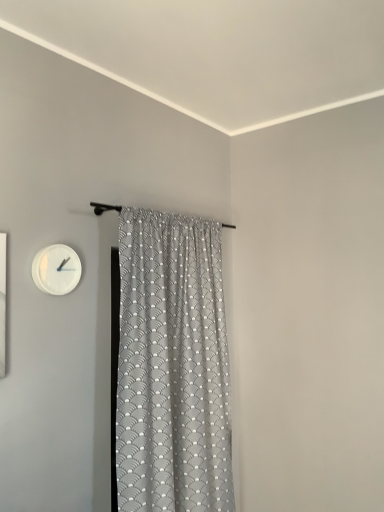
Question: Is gray textured fabric curtain at center far away from white matte wall clock at upper left?

Choices:
 (A) yes
 (B) no

Answer: (B)

Question: Is gray textured fabric curtain at center wider than white matte wall clock at upper left?

Choices:
 (A) no
 (B) yes

Answer: (B)

Question: Considering the relative sizes of gray textured fabric curtain at center and white matte wall clock at upper left in the image provided, is gray textured fabric curtain at center taller than white matte wall clock at upper left?

Choices:
 (A) yes
 (B) no

Answer: (A)

Question: Is gray textured fabric curtain at center in contact with white matte wall clock at upper left?

Choices:
 (A) no
 (B) yes

Answer: (A)

Question: Does gray textured fabric curtain at center appear on the left side of white matte wall clock at upper left?

Choices:
 (A) no
 (B) yes

Answer: (A)

Question: From a real-world perspective, is gray textured fabric curtain at center under white matte wall clock at upper left?

Choices:
 (A) no
 (B) yes

Answer: (B)

Question: Does white matte wall clock at upper left have a lesser height compared to gray textured fabric curtain at center?

Choices:
 (A) yes
 (B) no

Answer: (A)

Question: Could you tell me if white matte wall clock at upper left is turned towards gray textured fabric curtain at center?

Choices:
 (A) yes
 (B) no

Answer: (B)

Question: Is white matte wall clock at upper left far from gray textured fabric curtain at center?

Choices:
 (A) yes
 (B) no

Answer: (B)

Question: From a real-world perspective, is white matte wall clock at upper left on gray textured fabric curtain at center?

Choices:
 (A) no
 (B) yes

Answer: (B)

Question: Is white matte wall clock at upper left to the right of gray textured fabric curtain at center from the viewer's perspective?

Choices:
 (A) no
 (B) yes

Answer: (A)

Question: Does white matte wall clock at upper left come behind gray textured fabric curtain at center?

Choices:
 (A) no
 (B) yes

Answer: (B)

Question: Looking at the image, does gray textured fabric curtain at center seem bigger or smaller compared to white matte wall clock at upper left?

Choices:
 (A) big
 (B) small

Answer: (A)